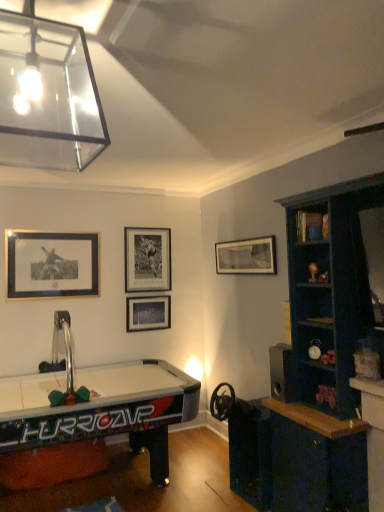
Question: Should I look upward or downward to see clear glass pendant light at upper left?

Choices:
 (A) up
 (B) down

Answer: (A)

Question: Is black matte picture frame at upper center, the second picture frame positioned from the left, far away from matte black picture frame at center, the third picture frame in the left-to-right sequence?

Choices:
 (A) yes
 (B) no

Answer: (B)

Question: Considering the relative positions of black matte picture frame at upper center, the second picture frame positioned from the left, and matte black picture frame at center, the third picture frame in the left-to-right sequence, in the image provided, is black matte picture frame at upper center, the second picture frame positioned from the left, to the left of matte black picture frame at center, the third picture frame in the left-to-right sequence, from the viewer's perspective?

Choices:
 (A) yes
 (B) no

Answer: (A)

Question: Is black matte picture frame at upper center, the 3th picture frame viewed from the right, smaller than matte black picture frame at center, the third picture frame in the left-to-right sequence?

Choices:
 (A) no
 (B) yes

Answer: (A)

Question: From a real-world perspective, is black matte picture frame at upper center, the 3th picture frame viewed from the right, over matte black picture frame at center, positioned as the second picture frame in right-to-left order?

Choices:
 (A) no
 (B) yes

Answer: (B)

Question: From the image's perspective, is black matte picture frame at upper center, the second picture frame positioned from the left, located above matte black picture frame at center, the third picture frame in the left-to-right sequence?

Choices:
 (A) yes
 (B) no

Answer: (A)

Question: Considering the relative sizes of black matte picture frame at upper center, the second picture frame positioned from the left, and matte black picture frame at center, the third picture frame in the left-to-right sequence, in the image provided, is black matte picture frame at upper center, the second picture frame positioned from the left, shorter than matte black picture frame at center, the third picture frame in the left-to-right sequence,?

Choices:
 (A) no
 (B) yes

Answer: (A)

Question: Can you confirm if clear glass pendant light at upper left is thinner than wooden bookshelf at upper right?

Choices:
 (A) yes
 (B) no

Answer: (B)

Question: From the image's perspective, is clear glass pendant light at upper left above wooden bookshelf at upper right?

Choices:
 (A) yes
 (B) no

Answer: (A)

Question: Does clear glass pendant light at upper left have a greater width compared to wooden bookshelf at upper right?

Choices:
 (A) no
 (B) yes

Answer: (B)

Question: Is clear glass pendant light at upper left closer to the viewer compared to wooden bookshelf at upper right?

Choices:
 (A) no
 (B) yes

Answer: (B)

Question: Is clear glass pendant light at upper left located outside wooden bookshelf at upper right?

Choices:
 (A) no
 (B) yes

Answer: (B)

Question: Is the position of clear glass pendant light at upper left more distant than that of wooden bookshelf at upper right?

Choices:
 (A) yes
 (B) no

Answer: (B)

Question: Can you confirm if black matte picture frame at upper center, marked as the 1th picture frame in a right-to-left arrangement, is shorter than black matte picture frame at upper center, the second picture frame positioned from the left?

Choices:
 (A) no
 (B) yes

Answer: (B)